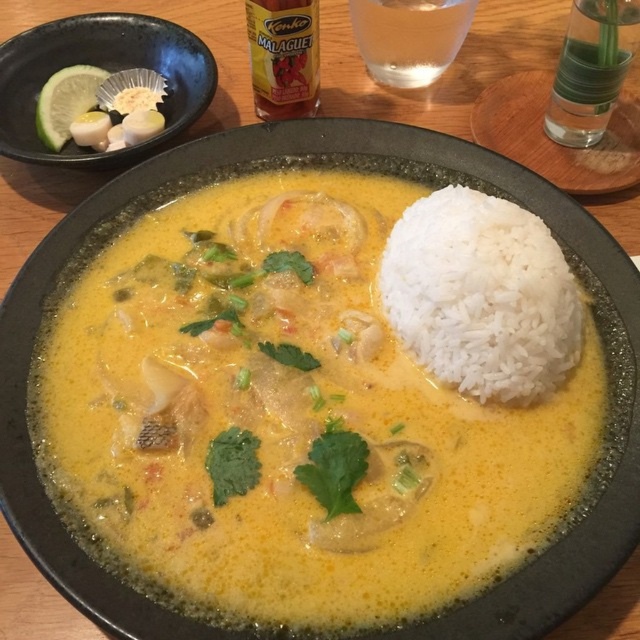
Question: Observing the image, what is the correct spatial positioning of yellow creamy broth at center in reference to clear glass at upper right?

Choices:
 (A) below
 (B) above

Answer: (A)

Question: Which of the following is the farthest from the observer?

Choices:
 (A) (612, 24)
 (B) (577, 332)

Answer: (A)

Question: Is black ceramic bowl at upper left to the left of clear glass at upper right from the viewer's perspective?

Choices:
 (A) no
 (B) yes

Answer: (B)

Question: Which point is farther from the camera taking this photo?

Choices:
 (A) (401, 440)
 (B) (589, 67)
 (C) (369, 60)
 (D) (74, 26)

Answer: (C)

Question: Among these objects, which one is farthest from the camera?

Choices:
 (A) yellow creamy broth at center
 (B) clear glass at upper center

Answer: (B)

Question: Is clear glass at upper right smaller than clear glass at upper center?

Choices:
 (A) yes
 (B) no

Answer: (A)